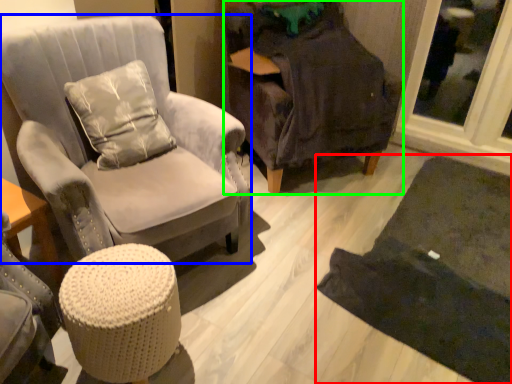
Question: Which object is positioned farthest from mat (highlighted by a red box)? Select from chair (highlighted by a blue box) and chair (highlighted by a green box).

Choices:
 (A) chair
 (B) chair

Answer: (A)